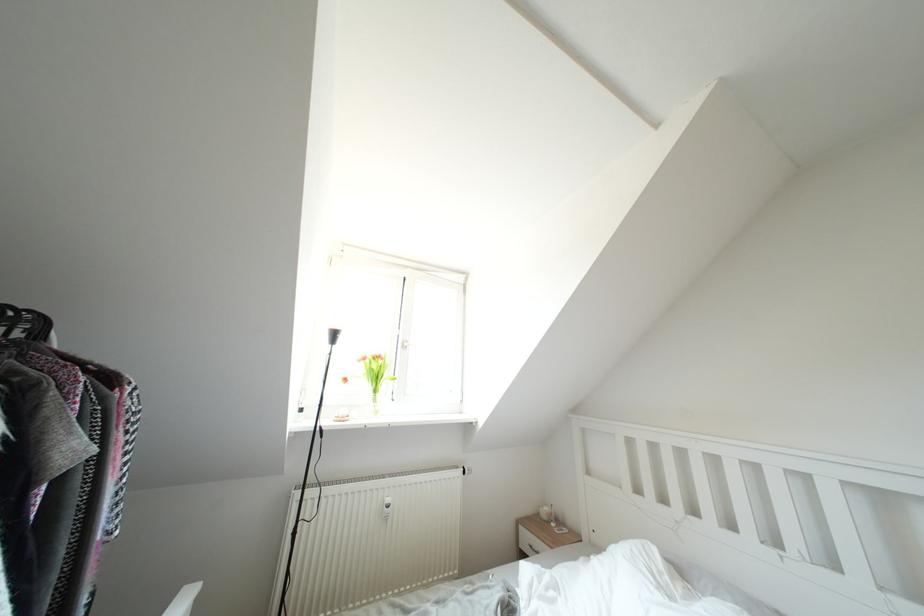
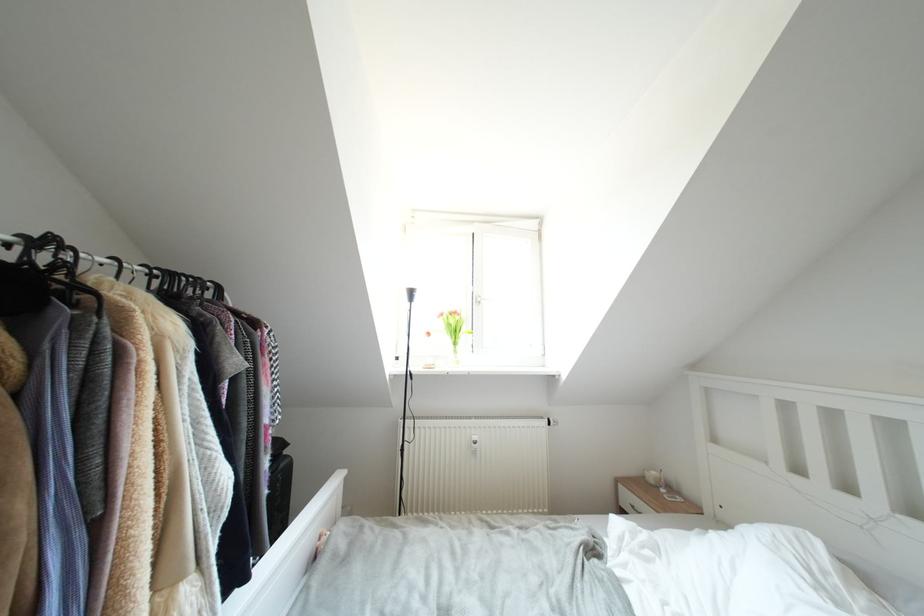
Question: How did the camera likely rotate?

Choices:
 (A) Left
 (B) Right
 (C) Up
 (D) Down

Answer: (A)